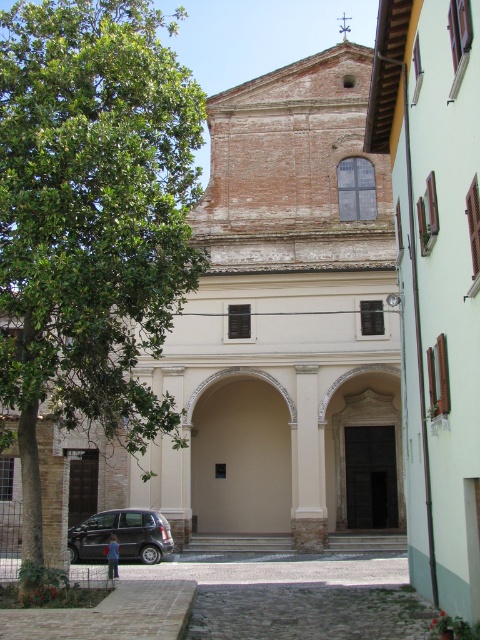
You are standing in front of the historic building and want to locate the beige stone archway at center. Where would you look relative to the point at coordinates point (241, 458)?

The beige stone archway at center is located at the point (241, 458).

You are standing in front of the historic building and want to enter through the entrance. Which object should you approach first, the brick textured church at center or the beige stone archway at center?

You should approach the beige stone archway at center first because the brick textured church at center is positioned over it, meaning the archway is the actual entrance.

You are standing in front of the historic building and want to take a photo that includes both the brick textured church at center and the beige stone archway at center. Which object should you focus on first to ensure both are in frame?

You should focus on the brick textured church at center first because it is closer to the viewer than the beige stone archway at center, so adjusting the camera to include both would require starting with the closer object.